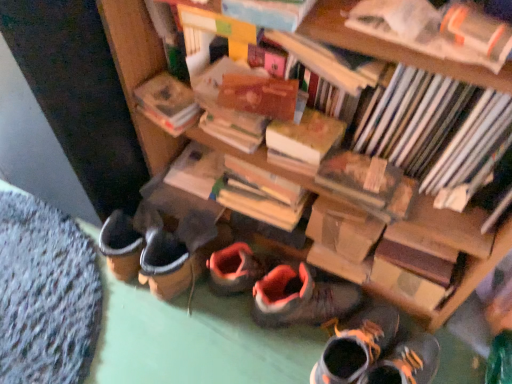
Question: Does hardcover book at center, the 1th paperback book when ordered from right to left, have a lesser height compared to hardcover book at upper center, which is counted as the fourth book, starting from the back?

Choices:
 (A) yes
 (B) no

Answer: (B)

Question: Does hardcover book at center, the 1th paperback book when ordered from right to left, have a smaller size compared to hardcover book at upper center, which is counted as the fourth book, starting from the back?

Choices:
 (A) yes
 (B) no

Answer: (B)

Question: Is hardcover book at center, the 1th paperback book when ordered from right to left, looking in the opposite direction of hardcover book at upper center, which is counted as the fourth book, starting from the back?

Choices:
 (A) yes
 (B) no

Answer: (B)

Question: From the image's perspective, would you say hardcover book at center, the 1th paperback book when ordered from right to left, is shown under hardcover book at upper center, positioned as the second book in front-to-back order?

Choices:
 (A) no
 (B) yes

Answer: (B)

Question: From a real-world perspective, is hardcover book at center, the 1th paperback book when ordered from right to left, located beneath hardcover book at upper center, positioned as the second book in front-to-back order?

Choices:
 (A) no
 (B) yes

Answer: (B)

Question: From a real-world perspective, is hardcover book at center, which is counted as the 1th book, starting from the back, positioned above or below orange suede sneaker at center, positioned as the first footwear in left-to-right order?

Choices:
 (A) above
 (B) below

Answer: (A)

Question: Considering the positions of point (206, 193) and point (340, 312), is point (206, 193) closer or farther from the camera than point (340, 312)?

Choices:
 (A) closer
 (B) farther

Answer: (B)

Question: From the image's perspective, relative to orange suede sneaker at center, positioned as the first footwear in left-to-right order, is hardcover book at center, which is counted as the 1th book, starting from the back, above or below?

Choices:
 (A) above
 (B) below

Answer: (A)

Question: Looking at the image, does hardcover book at center, arranged as the fifth book when viewed from the front, seem bigger or smaller compared to orange suede sneaker at center, positioned as the first footwear in left-to-right order?

Choices:
 (A) small
 (B) big

Answer: (A)

Question: Choose the correct answer: Is hardcover book at upper center, positioned as the second book in front-to-back order, inside hardcover books at upper right, marked as the third book in a back-to-front arrangement, or outside it?

Choices:
 (A) inside
 (B) outside

Answer: (B)

Question: Considering the positions of hardcover book at upper center, positioned as the second book in front-to-back order, and hardcover books at upper right, which is the 3th book in front-to-back order, in the image, is hardcover book at upper center, positioned as the second book in front-to-back order, taller or shorter than hardcover books at upper right, which is the 3th book in front-to-back order,?

Choices:
 (A) tall
 (B) short

Answer: (B)

Question: In terms of size, does hardcover book at upper center, which is counted as the fourth book, starting from the back, appear bigger or smaller than hardcover books at upper right, marked as the third book in a back-to-front arrangement?

Choices:
 (A) big
 (B) small

Answer: (B)

Question: From a real-world perspective, is hardcover book at upper center, which is counted as the fourth book, starting from the back, above or below hardcover books at upper right, marked as the third book in a back-to-front arrangement?

Choices:
 (A) below
 (B) above

Answer: (B)

Question: In terms of size, does hardcover book at upper right, which appears as the fifth book when viewed from the back, appear bigger or smaller than hardcover book at center, which is counted as the 4th book, starting from the front?

Choices:
 (A) big
 (B) small

Answer: (B)

Question: Considering the positions of hardcover book at upper right, which appears as the fifth book when viewed from the back, and hardcover book at center, which is counted as the 4th book, starting from the front, in the image, is hardcover book at upper right, which appears as the fifth book when viewed from the back, taller or shorter than hardcover book at center, which is counted as the 4th book, starting from the front,?

Choices:
 (A) tall
 (B) short

Answer: (B)